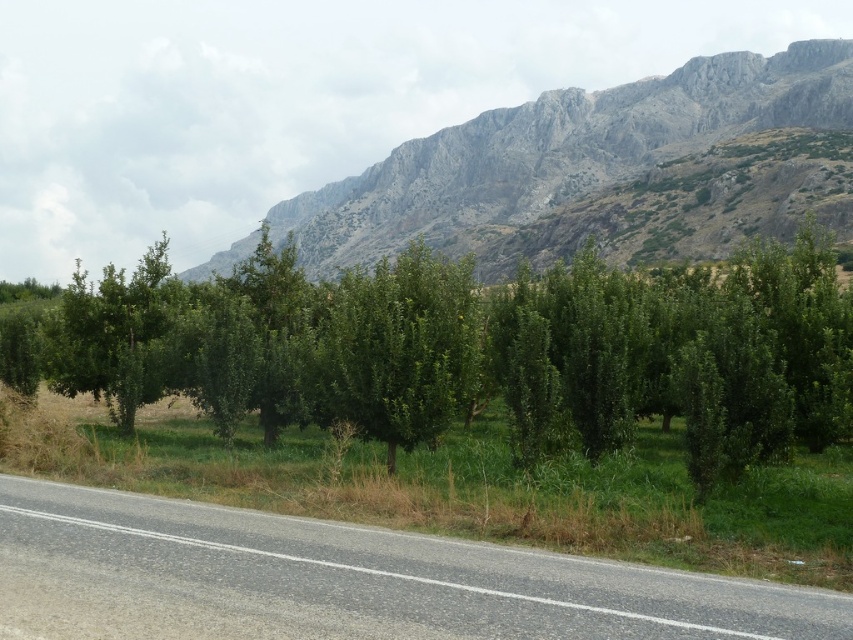
Question: Does gray asphalt road at lower left have a larger size compared to gray rocky mountain at upper center?

Choices:
 (A) yes
 (B) no

Answer: (B)

Question: Which of the following is the closest to the observer?

Choices:
 (A) (547, 148)
 (B) (376, 557)

Answer: (B)

Question: Is gray asphalt road at lower left thinner than gray rocky mountain at upper center?

Choices:
 (A) yes
 (B) no

Answer: (A)

Question: Among these points, which one is nearest to the camera?

Choices:
 (A) (534, 440)
 (B) (810, 120)
 (C) (363, 588)

Answer: (C)

Question: Which object is farther from the camera taking this photo?

Choices:
 (A) gray rocky mountain at upper center
 (B) green leafy tree at center

Answer: (A)

Question: Can you confirm if green leafy tree at center is wider than gray rocky mountain at upper center?

Choices:
 (A) yes
 (B) no

Answer: (B)